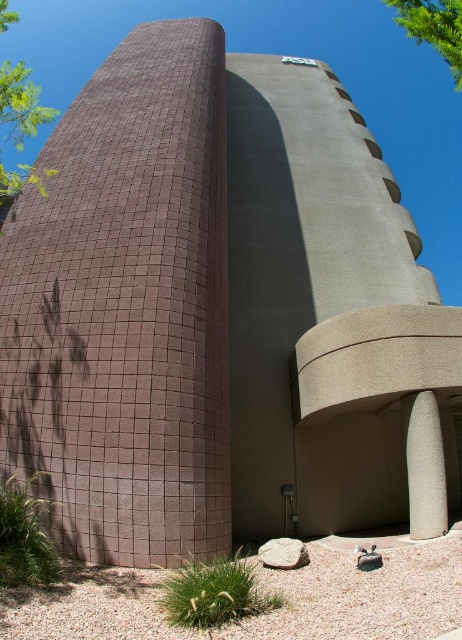
You are standing in front of the building and want to walk towards the green leafy tree at upper left and the green leafy tree at upper right. Which tree will you reach first?

The green leafy tree at upper left is closer to you than the green leafy tree at upper right, so you will reach the green leafy tree at upper left first.

You are a landscape architect planning to add a new pathway between the green leafy tree at upper left and the green leafy tree at upper right. Based on their positions, which tree should the pathway start closer to the bottom of the image?

The green leafy tree at upper left is located below the green leafy tree at upper right, so the pathway should start closer to the bottom of the image near the green leafy tree at upper left.

You are a landscape architect designing a garden path between the green leafy tree at upper left and the green leafy tree at upper right. Considering their widths, which tree should you place closer to the path to ensure better visibility?

The green leafy tree at upper left has a lesser width compared to the green leafy tree at upper right, so placing the narrower tree closer to the path would allow for better visibility and space management.